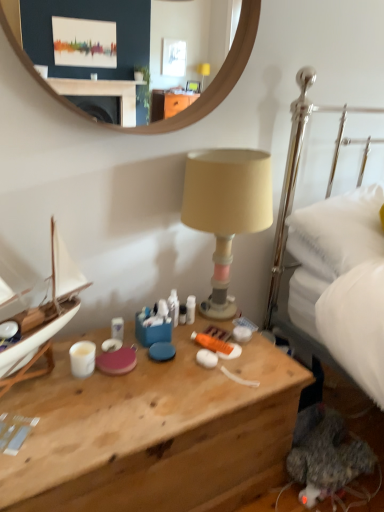
Question: Is beige fabric lampshade at center located outside wooden desk at center?

Choices:
 (A) yes
 (B) no

Answer: (A)

Question: Can wooden desk at center be found inside beige fabric lampshade at center?

Choices:
 (A) yes
 (B) no

Answer: (B)

Question: Is beige fabric lampshade at center next to wooden desk at center and touching it?

Choices:
 (A) no
 (B) yes

Answer: (A)

Question: Is beige fabric lampshade at center to the left of wooden desk at center from the viewer's perspective?

Choices:
 (A) yes
 (B) no

Answer: (B)

Question: Can you confirm if beige fabric lampshade at center is taller than wooden desk at center?

Choices:
 (A) yes
 (B) no

Answer: (A)

Question: From the image's perspective, is beige fabric lampshade at center beneath wooden desk at center?

Choices:
 (A) yes
 (B) no

Answer: (B)

Question: Considering the relative sizes of white soft pillow at right and white glossy coffee cup at lower left in the image provided, is white soft pillow at right wider than white glossy coffee cup at lower left?

Choices:
 (A) yes
 (B) no

Answer: (A)

Question: Is white soft pillow at right completely or partially outside of white glossy coffee cup at lower left?

Choices:
 (A) no
 (B) yes

Answer: (B)

Question: Considering the relative sizes of white soft pillow at right and white glossy coffee cup at lower left in the image provided, is white soft pillow at right taller than white glossy coffee cup at lower left?

Choices:
 (A) no
 (B) yes

Answer: (B)

Question: Is white soft pillow at right to the right of white glossy coffee cup at lower left from the viewer's perspective?

Choices:
 (A) yes
 (B) no

Answer: (A)

Question: Is white soft pillow at right further to the viewer compared to white glossy coffee cup at lower left?

Choices:
 (A) yes
 (B) no

Answer: (A)

Question: Can you confirm if white soft pillow at right is shorter than white glossy coffee cup at lower left?

Choices:
 (A) no
 (B) yes

Answer: (A)

Question: Is wooden desk at center bigger than white glossy coffee cup at lower left?

Choices:
 (A) no
 (B) yes

Answer: (B)